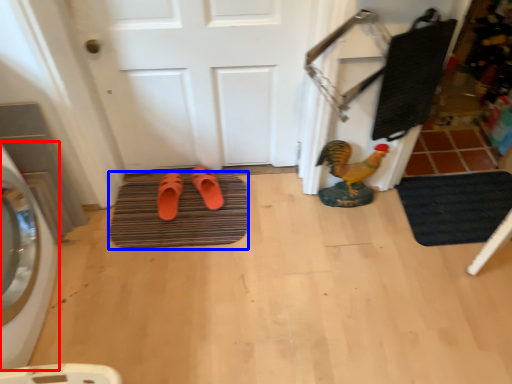
Question: Which of the following is the farthest to the observer, washing machine (highlighted by a red box) or bath mat (highlighted by a blue box)?

Choices:
 (A) washing machine
 (B) bath mat

Answer: (B)